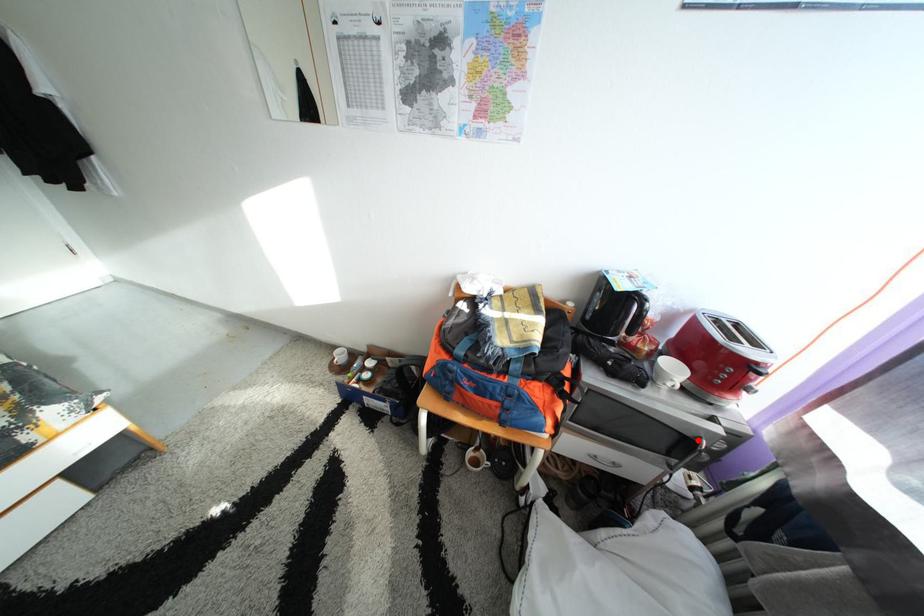
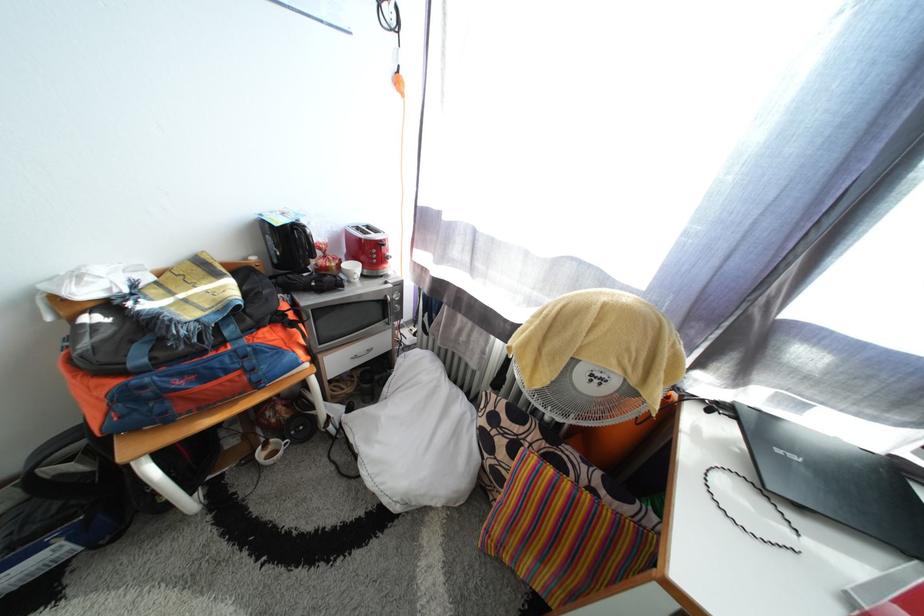
Question: I am providing you with two images of the same scene from different viewpoints. In image1, a red point is highlighted. Considering the same 3D point in image2, which of the following is correct?

Choices:
 (A) It is closer
 (B) It is farther

Answer: (A)